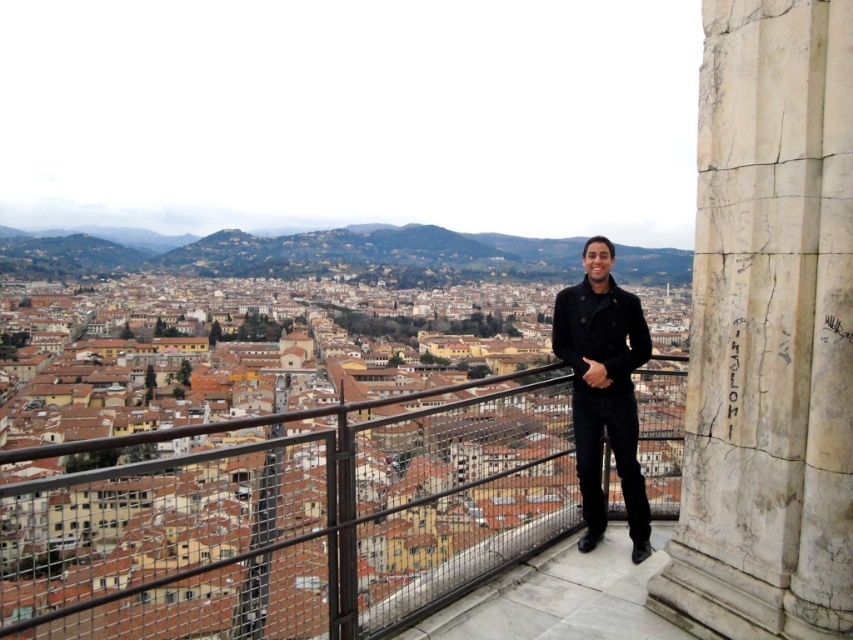
Question: Is metal mesh railing at center wider than white marble pillar at right?

Choices:
 (A) no
 (B) yes

Answer: (B)

Question: Which point is closer to the camera taking this photo?

Choices:
 (A) pos(734,120)
 (B) pos(288,436)
 (C) pos(608,288)

Answer: (A)

Question: Can you confirm if metal mesh railing at center is positioned below black wool coat at center?

Choices:
 (A) yes
 (B) no

Answer: (A)

Question: Can you confirm if metal mesh railing at center is positioned above black wool coat at center?

Choices:
 (A) yes
 (B) no

Answer: (B)

Question: Among these points, which one is nearest to the camera?

Choices:
 (A) (x=619, y=307)
 (B) (x=190, y=627)

Answer: (A)

Question: Among these points, which one is farthest from the camera?

Choices:
 (A) (219, 595)
 (B) (828, 298)

Answer: (A)